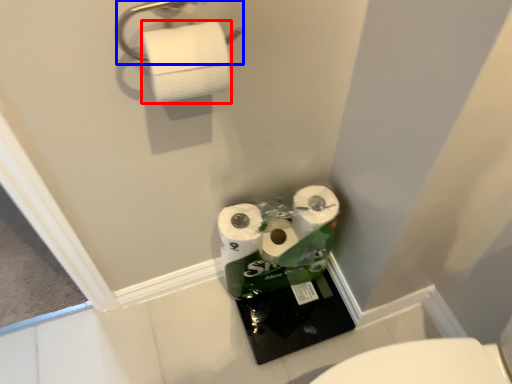
Question: Which point is further to the camera, toilet paper (highlighted by a red box) or towel bar (highlighted by a blue box)?

Choices:
 (A) toilet paper
 (B) towel bar

Answer: (A)